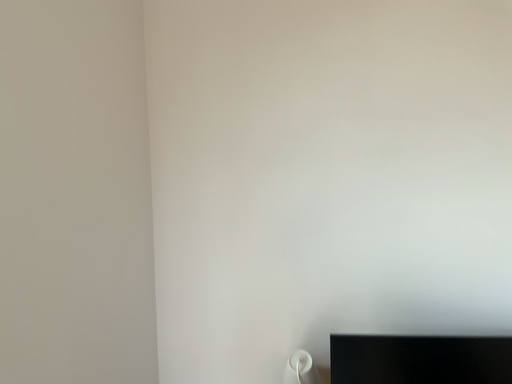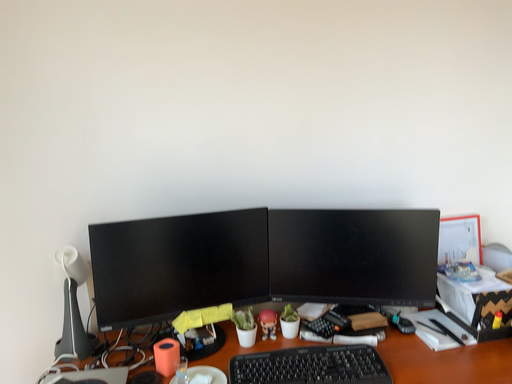
Question: How did the camera likely rotate when shooting the video?

Choices:
 (A) rotated upward
 (B) rotated downward

Answer: (B)